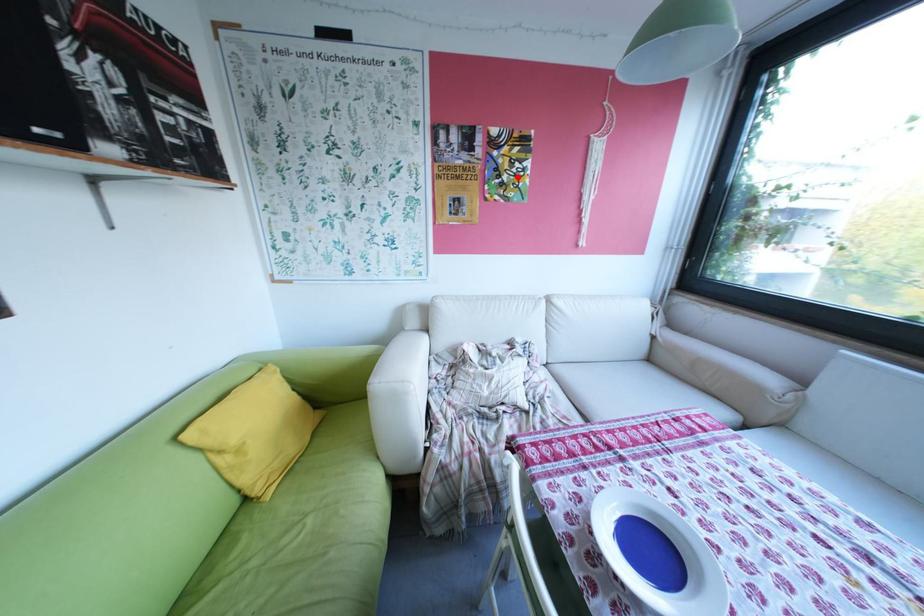
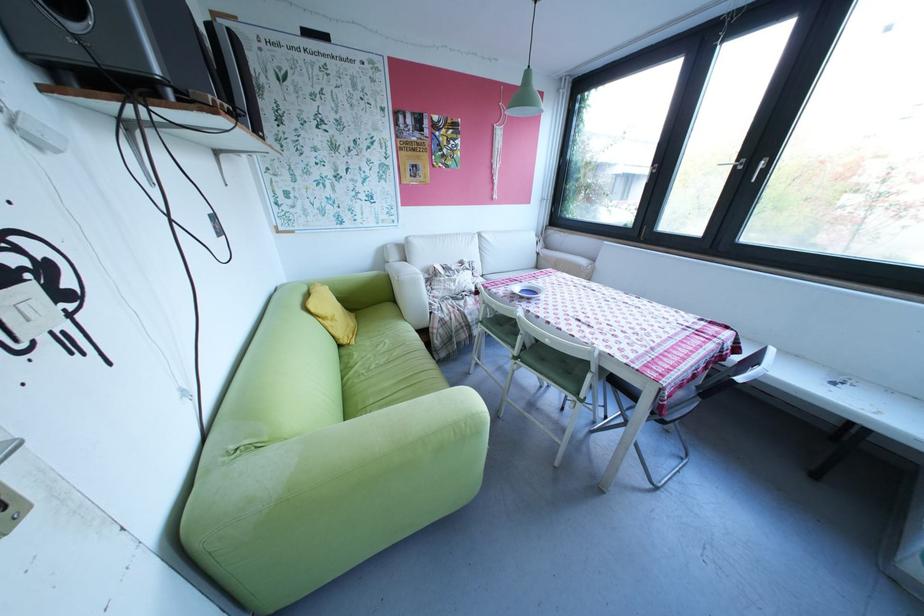
The point at the highlighted location is marked in the first image. Where is the corresponding point in the second image?

(457, 151)